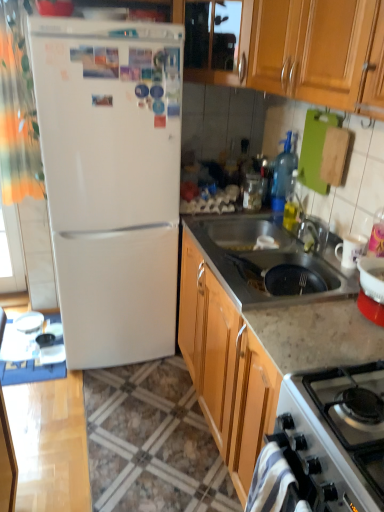
Question: Is white glossy refrigerator at left not close to white glossy gas stove at lower right?

Choices:
 (A) no
 (B) yes

Answer: (B)

Question: Considering the relative sizes of white glossy refrigerator at left and white glossy gas stove at lower right in the image provided, is white glossy refrigerator at left bigger than white glossy gas stove at lower right?

Choices:
 (A) no
 (B) yes

Answer: (B)

Question: Can you confirm if white glossy refrigerator at left is smaller than white glossy gas stove at lower right?

Choices:
 (A) no
 (B) yes

Answer: (A)

Question: Considering the relative sizes of white glossy refrigerator at left and white glossy gas stove at lower right in the image provided, is white glossy refrigerator at left shorter than white glossy gas stove at lower right?

Choices:
 (A) no
 (B) yes

Answer: (A)

Question: Can you confirm if white glossy refrigerator at left is taller than white glossy gas stove at lower right?

Choices:
 (A) yes
 (B) no

Answer: (A)

Question: Does point (33, 41) appear closer or farther from the camera than point (249, 183)?

Choices:
 (A) farther
 (B) closer

Answer: (B)

Question: Is white glossy refrigerator at left taller or shorter than transparent glass jar at upper center?

Choices:
 (A) tall
 (B) short

Answer: (A)

Question: Is white glossy refrigerator at left bigger or smaller than transparent glass jar at upper center?

Choices:
 (A) small
 (B) big

Answer: (B)

Question: Is white glossy refrigerator at left wider or thinner than transparent glass jar at upper center?

Choices:
 (A) wide
 (B) thin

Answer: (A)

Question: Is point (132, 467) positioned closer to the camera than point (130, 353)?

Choices:
 (A) farther
 (B) closer

Answer: (B)

Question: Choose the correct answer: Is marble countertop at lower right inside white glossy refrigerator at left or outside it?

Choices:
 (A) outside
 (B) inside

Answer: (A)

Question: Is marble countertop at lower right taller or shorter than white glossy refrigerator at left?

Choices:
 (A) tall
 (B) short

Answer: (B)

Question: From the image's perspective, is marble countertop at lower right located above or below white glossy refrigerator at left?

Choices:
 (A) below
 (B) above

Answer: (A)

Question: Based on their positions, is marble countertop at lower right located to the left or right of stainless steel sink at lower center?

Choices:
 (A) left
 (B) right

Answer: (A)

Question: Is marble countertop at lower right taller or shorter than stainless steel sink at lower center?

Choices:
 (A) tall
 (B) short

Answer: (B)